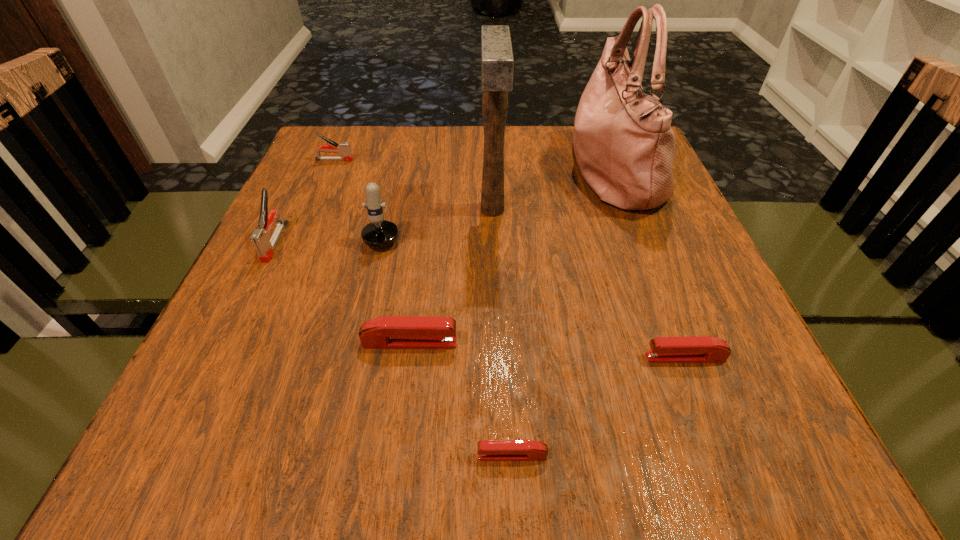
Identify which object is the third nearest to the farther gray stapler. Please provide its 2D coordinates. Your answer should be formatted as a tuple, i.e. [(x, y)], where the tuple contains the x and y coordinates of a point satisfying the conditions above.

[(497, 63)]

Locate which stapler is the fourth closest to the farther gray stapler. Please provide its 2D coordinates. Your answer should be formatted as a tuple, i.e. [(x, y)], where the tuple contains the x and y coordinates of a point satisfying the conditions above.

[(699, 349)]

This screenshot has width=960, height=540. In order to click on the closest stapler to the handbag in this screenshot , I will do `click(699, 349)`.

This screenshot has width=960, height=540. What are the coordinates of `red stapler object that ranks as the second closest to the second tallest stapler` in the screenshot? It's located at (488, 450).

Locate which red stapler is the second closest to the second red stapler from right to left. Please provide its 2D coordinates. Your answer should be formatted as a tuple, i.e. [(x, y)], where the tuple contains the x and y coordinates of a point satisfying the conditions above.

[(699, 349)]

This screenshot has height=540, width=960. Find the location of `vacant region that satisfies the following two spatial constraints: 1. on the handle side of the mallet; 2. on the left side of the fourth shortest stapler`. vacant region that satisfies the following two spatial constraints: 1. on the handle side of the mallet; 2. on the left side of the fourth shortest stapler is located at coordinates (313, 209).

This screenshot has width=960, height=540. Identify the location of free point that satisfies the following two spatial constraints: 1. on the front side of the mallet; 2. on the front-facing side of the third stapler from left to right. (496, 342).

This screenshot has width=960, height=540. Find the location of `free space that satisfies the following two spatial constraints: 1. on the handle side of the farther gray stapler; 2. on the right side of the mallet`. free space that satisfies the following two spatial constraints: 1. on the handle side of the farther gray stapler; 2. on the right side of the mallet is located at coordinates (313, 209).